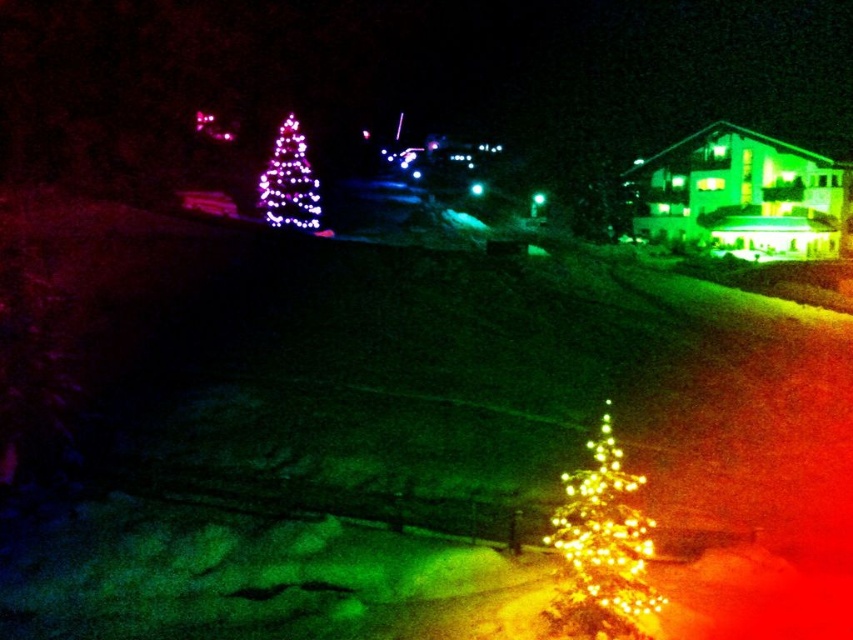
Question: Which point appears farthest from the camera in this image?

Choices:
 (A) (299, 195)
 (B) (584, 496)

Answer: (A)

Question: Considering the relative positions of illuminated plastic christmas tree at lower right and illuminated plastic christmas tree at upper left in the image provided, where is illuminated plastic christmas tree at lower right located with respect to illuminated plastic christmas tree at upper left?

Choices:
 (A) right
 (B) left

Answer: (A)

Question: Can you confirm if illuminated plastic christmas tree at lower right is thinner than illuminated plastic christmas tree at upper left?

Choices:
 (A) yes
 (B) no

Answer: (A)

Question: Is illuminated plastic christmas tree at lower right wider than illuminated plastic christmas tree at upper left?

Choices:
 (A) yes
 (B) no

Answer: (B)